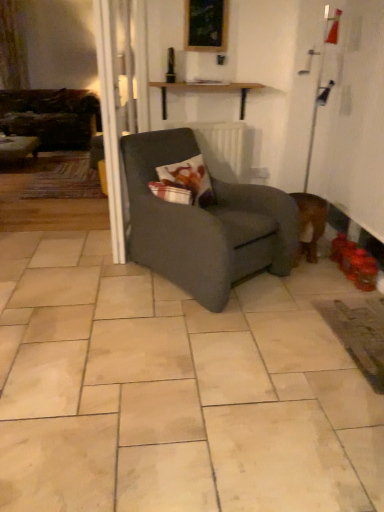
Question: Is wooden picture frame at upper center further to camera compared to velvet dark brown couch at left?

Choices:
 (A) yes
 (B) no

Answer: (B)

Question: From a real-world perspective, does wooden picture frame at upper center sit lower than velvet dark brown couch at left?

Choices:
 (A) yes
 (B) no

Answer: (B)

Question: Is wooden picture frame at upper center oriented towards velvet dark brown couch at left?

Choices:
 (A) no
 (B) yes

Answer: (A)

Question: Can you confirm if wooden picture frame at upper center is thinner than velvet dark brown couch at left?

Choices:
 (A) yes
 (B) no

Answer: (A)

Question: Can you confirm if wooden picture frame at upper center is bigger than velvet dark brown couch at left?

Choices:
 (A) yes
 (B) no

Answer: (B)

Question: Can velvet dark brown couch at left be found inside wooden picture frame at upper center?

Choices:
 (A) yes
 (B) no

Answer: (B)

Question: Considering the relative sizes of wooden picture frame at upper center and dark gray fabric chair at center in the image provided, is wooden picture frame at upper center bigger than dark gray fabric chair at center?

Choices:
 (A) yes
 (B) no

Answer: (B)

Question: Considering the relative sizes of wooden picture frame at upper center and dark gray fabric chair at center in the image provided, is wooden picture frame at upper center shorter than dark gray fabric chair at center?

Choices:
 (A) yes
 (B) no

Answer: (A)

Question: Is wooden picture frame at upper center not close to dark gray fabric chair at center?

Choices:
 (A) no
 (B) yes

Answer: (B)

Question: Is wooden picture frame at upper center facing away from dark gray fabric chair at center?

Choices:
 (A) yes
 (B) no

Answer: (B)

Question: Is wooden picture frame at upper center outside dark gray fabric chair at center?

Choices:
 (A) yes
 (B) no

Answer: (A)

Question: Is wooden picture frame at upper center at the left side of dark gray fabric chair at center?

Choices:
 (A) no
 (B) yes

Answer: (A)

Question: Considering the relative sizes of printed fabric pillow at center and velvet dark brown couch at left in the image provided, is printed fabric pillow at center shorter than velvet dark brown couch at left?

Choices:
 (A) no
 (B) yes

Answer: (B)